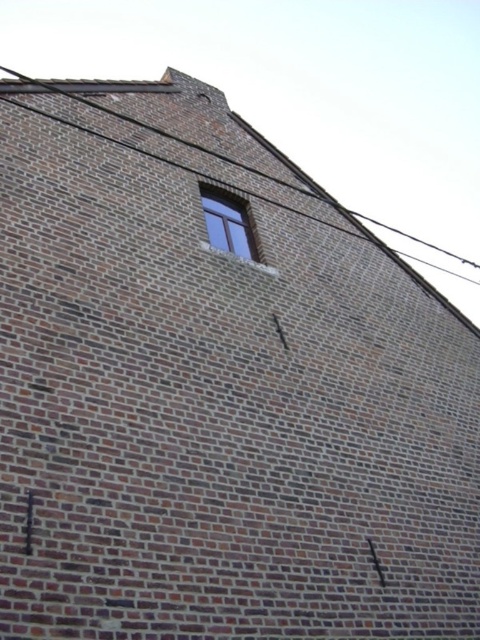
Which is in front, point (255, 132) or point (236, 230)?

Point (236, 230)

Which is in front, point (96, 83) or point (241, 212)?

Positioned in front is point (96, 83).

The image size is (480, 640). What are the coordinates of `brown wire at upper center` in the screenshot? It's located at (218, 152).